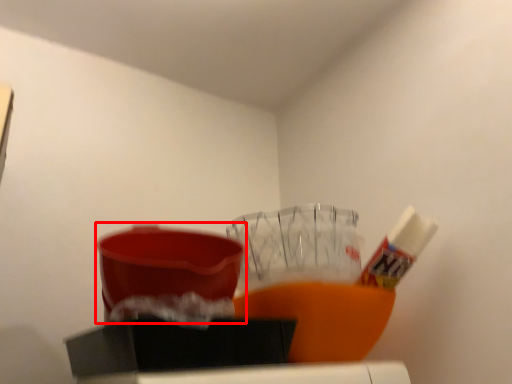
Question: Where is basin (annotated by the red box) located in relation to toothpaste in the image?

Choices:
 (A) right
 (B) left

Answer: (B)